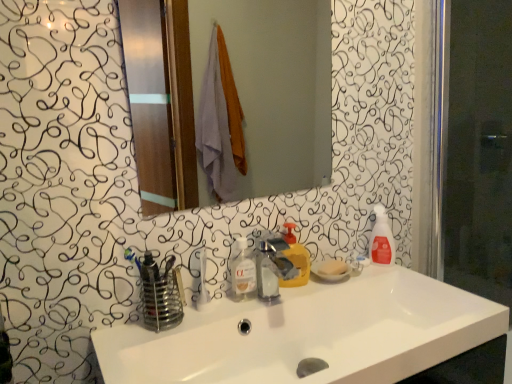
The width and height of the screenshot is (512, 384). Identify the location of free location in front of clear liquid soap at center. (221, 316).